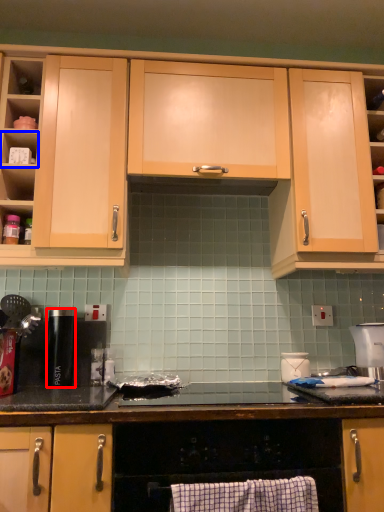
Question: Among these objects, which one is nearest to the camera, appliance (highlighted by a red box) or shelf (highlighted by a blue box)?

Choices:
 (A) appliance
 (B) shelf

Answer: (B)